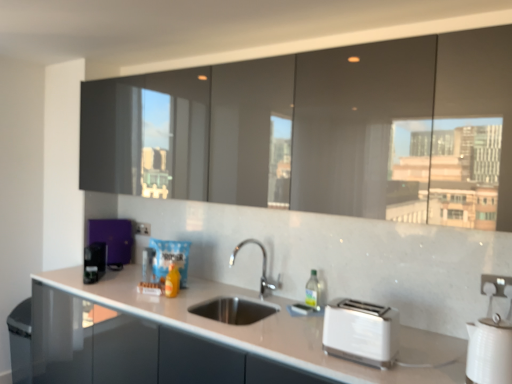
You are a GUI agent. You are given a task and a screenshot of the screen. Output one action in this format:
    pyautogui.click(x=<x>, y=<y>)
    Task: Click on the free location to the right of white plastic toaster at lower right
    The height and width of the screenshot is (384, 512).
    Given the screenshot: What is the action you would take?
    pyautogui.click(x=415, y=360)